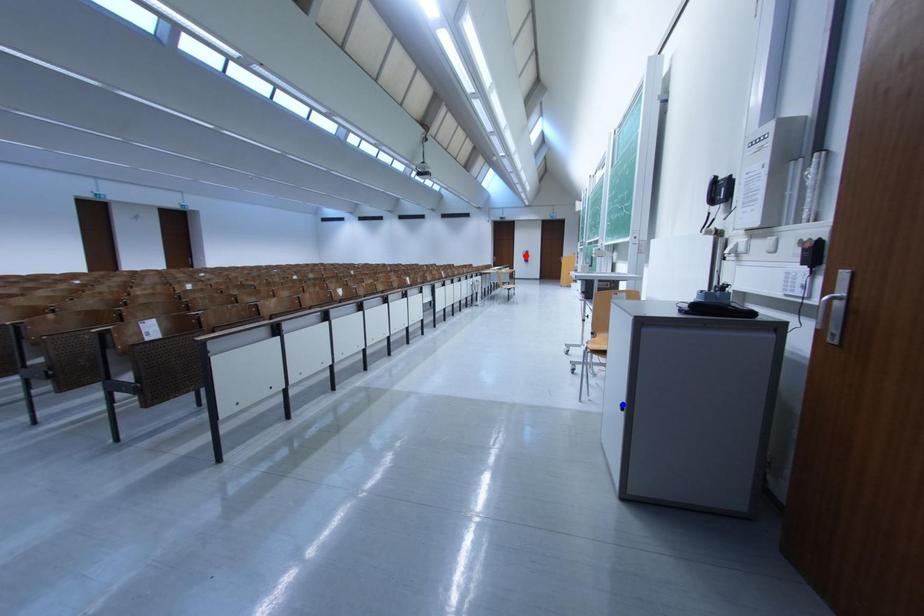
Question: Two points are marked on the image. Which point is closer to the camera?

Choices:
 (A) Blue point is closer.
 (B) Red point is closer.

Answer: (A)